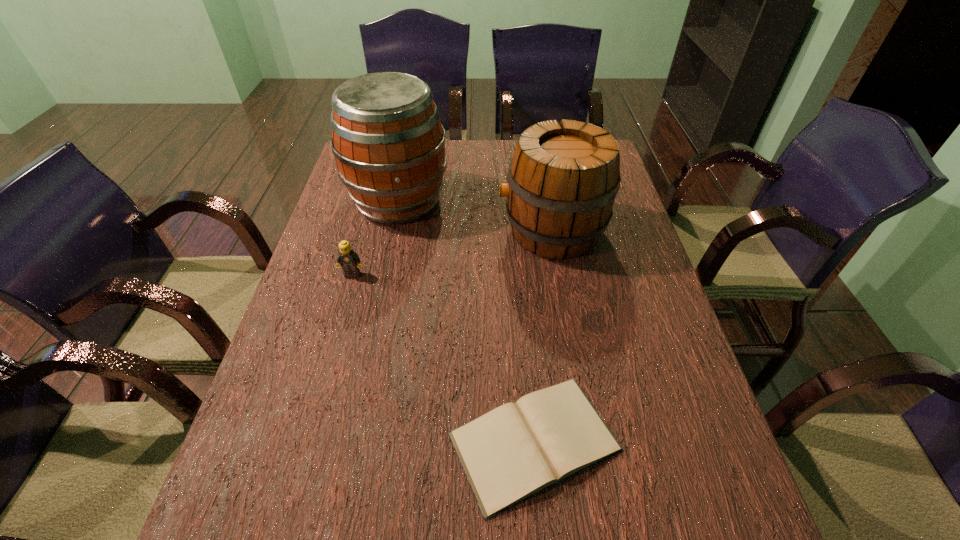
You are a GUI agent. You are given a task and a screenshot of the screen. Output one action in this format:
    pyautogui.click(x=<x>, y=<y>)
    Task: Click on the tallest object
    The image size is (960, 540).
    Given the screenshot: What is the action you would take?
    tap(389, 145)

Locate an element on the screen. This screenshot has width=960, height=540. the left cider is located at coordinates (389, 145).

What are the coordinates of `the right cider` in the screenshot? It's located at (563, 178).

At what (x,y) coordinates should I click in order to perform the action: click on the shorter cider. Please return your answer as a coordinate pair (x, y). The image size is (960, 540). Looking at the image, I should click on (563, 178).

Identify the location of the second nearest object. (349, 260).

Locate an element on the screen. This screenshot has height=540, width=960. the second shortest object is located at coordinates (349, 260).

This screenshot has width=960, height=540. What are the coordinates of `the nearest object` in the screenshot? It's located at point(517,450).

The height and width of the screenshot is (540, 960). I want to click on the shortest object, so click(517, 450).

Image resolution: width=960 pixels, height=540 pixels. Find the location of `free space located 0.340m on the front of the tallest object`. free space located 0.340m on the front of the tallest object is located at coordinates (372, 327).

The image size is (960, 540). I want to click on vacant point located 0.250m on the side of the third shortest object where the spigot is located, so click(x=412, y=231).